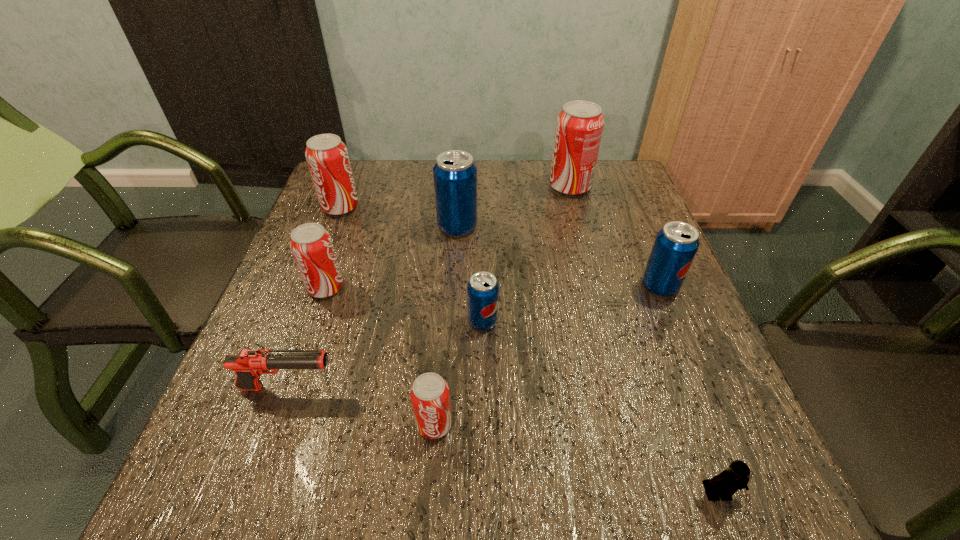
At what (x,y) coordinates should I click in order to perform the action: click on the biggest red soda can. Please return your answer as a coordinate pair (x, y). This screenshot has height=540, width=960. Looking at the image, I should click on pyautogui.click(x=579, y=126).

This screenshot has height=540, width=960. What are the coordinates of `the seventh object from left to right` in the screenshot? It's located at (579, 126).

Where is `the third smallest red soda can`? This screenshot has width=960, height=540. the third smallest red soda can is located at coordinates (327, 157).

The image size is (960, 540). In order to click on the biggest blue pop soda in this screenshot , I will do `click(455, 174)`.

I want to click on the third biggest red soda can, so click(311, 245).

Locate an element on the screen. This screenshot has width=960, height=540. the second farthest blue pop soda is located at coordinates (675, 246).

This screenshot has height=540, width=960. In order to click on the rightmost soda can in this screenshot , I will do `click(675, 246)`.

At what (x,y) coordinates should I click in order to perform the action: click on the nearest blue pop soda. Please return your answer as a coordinate pair (x, y). Image resolution: width=960 pixels, height=540 pixels. Looking at the image, I should click on (482, 289).

In order to click on the sixth farthest object in this screenshot , I will do `click(482, 289)`.

Image resolution: width=960 pixels, height=540 pixels. Identify the location of the smallest red soda can. (430, 397).